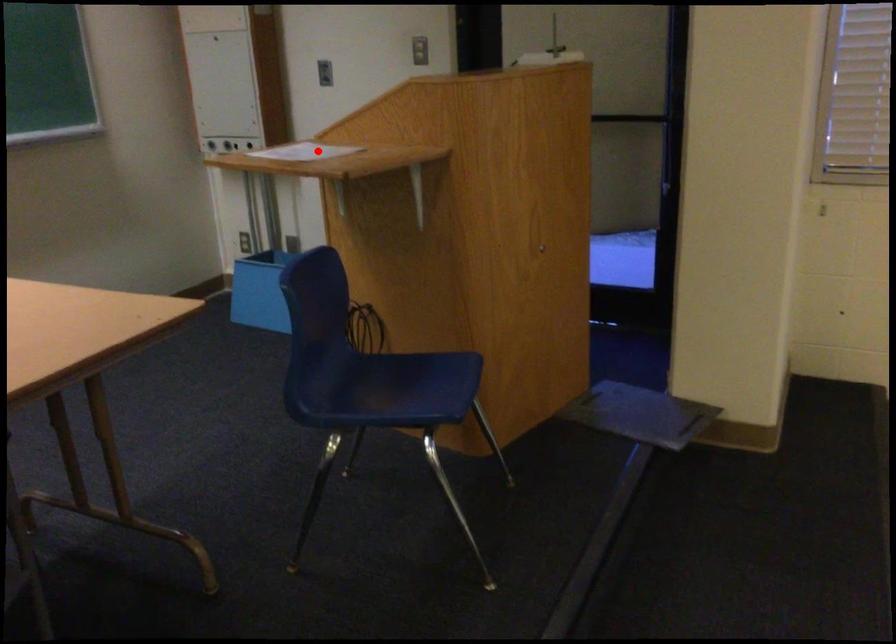
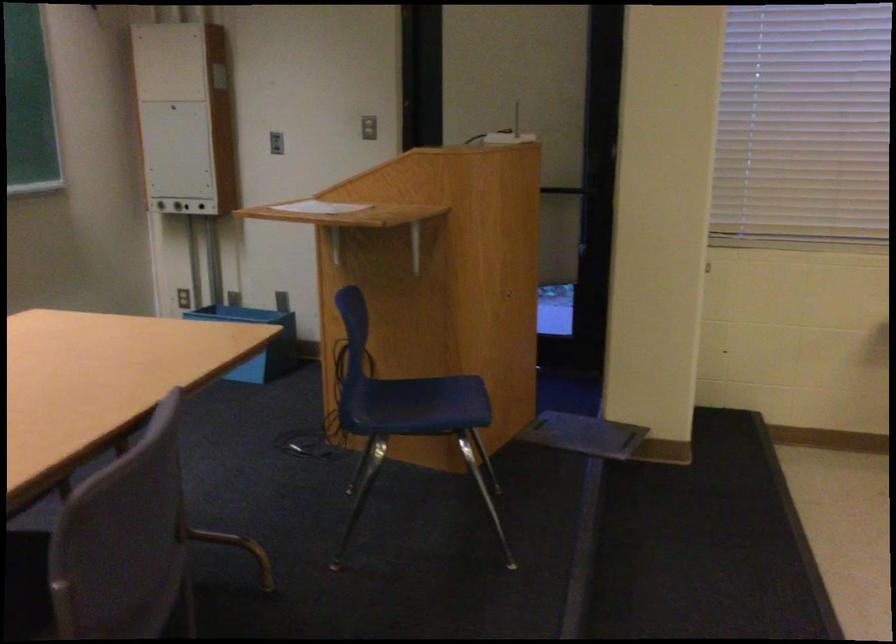
Find the pixel in the second image that matches the highlighted location in the first image.

(320, 207)